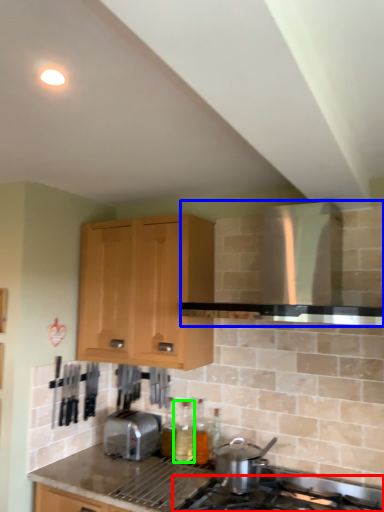
Question: Based on their relative distances, which object is farther from gas stove (highlighted by a red box)? Choose from vent (highlighted by a blue box) and bottle (highlighted by a green box).

Choices:
 (A) vent
 (B) bottle

Answer: (A)